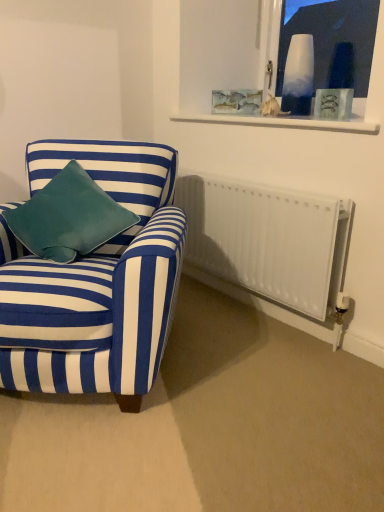
Question: From the image's perspective, would you say clear glass frame at upper center is shown under velvet teal pillow at left?

Choices:
 (A) yes
 (B) no

Answer: (B)

Question: Considering the relative positions of clear glass frame at upper center and velvet teal pillow at left in the image provided, is clear glass frame at upper center behind velvet teal pillow at left?

Choices:
 (A) yes
 (B) no

Answer: (A)

Question: Can you confirm if clear glass frame at upper center is bigger than velvet teal pillow at left?

Choices:
 (A) yes
 (B) no

Answer: (B)

Question: Could you tell me if clear glass frame at upper center is turned towards velvet teal pillow at left?

Choices:
 (A) yes
 (B) no

Answer: (B)

Question: Is the position of clear glass frame at upper center less distant than that of velvet teal pillow at left?

Choices:
 (A) yes
 (B) no

Answer: (B)

Question: In terms of height, does blue striped fabric armchair at left look taller or shorter compared to velvet teal pillow at left?

Choices:
 (A) short
 (B) tall

Answer: (B)

Question: Is blue striped fabric armchair at left wider or thinner than velvet teal pillow at left?

Choices:
 (A) thin
 (B) wide

Answer: (B)

Question: Is point (41, 263) positioned closer to the camera than point (28, 202)?

Choices:
 (A) closer
 (B) farther

Answer: (A)

Question: Looking at the image, does blue striped fabric armchair at left seem bigger or smaller compared to velvet teal pillow at left?

Choices:
 (A) small
 (B) big

Answer: (B)

Question: From a real-world perspective, is blue striped fabric armchair at left physically located above or below white matte radiator at lower right?

Choices:
 (A) above
 (B) below

Answer: (A)

Question: Would you say blue striped fabric armchair at left is to the left or to the right of white matte radiator at lower right in the picture?

Choices:
 (A) right
 (B) left

Answer: (B)

Question: Is blue striped fabric armchair at left bigger or smaller than white matte radiator at lower right?

Choices:
 (A) small
 (B) big

Answer: (B)

Question: From the image's perspective, relative to white matte radiator at lower right, is blue striped fabric armchair at left above or below?

Choices:
 (A) below
 (B) above

Answer: (A)

Question: Is point tap(281, 18) closer or farther from the camera than point tap(339, 118)?

Choices:
 (A) farther
 (B) closer

Answer: (A)

Question: Based on their sizes in the image, would you say white glass vase at upper right is bigger or smaller than clear glass frame at upper center?

Choices:
 (A) small
 (B) big

Answer: (B)